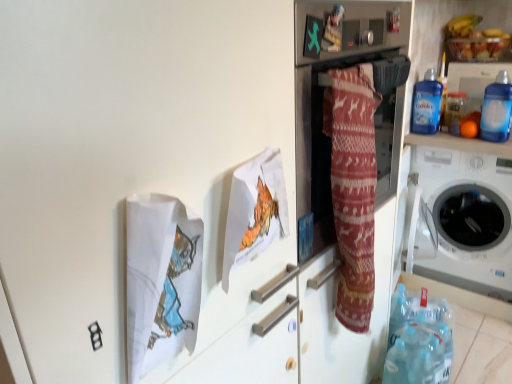
Question: From a real-world perspective, relative to blue plastic bottle at upper right, marked as the third bottle in a back-to-front arrangement, is orange matte at upper right vertically above or below?

Choices:
 (A) below
 (B) above

Answer: (A)

Question: Is point (459, 130) closer or farther from the camera than point (433, 82)?

Choices:
 (A) closer
 (B) farther

Answer: (B)

Question: Which object is positioned farthest from the patterned fabric at center?

Choices:
 (A) transparent plastic bottle at upper right, the third bottle from the front
 (B) blue plastic bottle at upper right, which appears as the 2th bottle when viewed from the front
 (C) blue plastic bottle at upper right, the 1th bottle viewed from the front
 (D) orange matte at upper right
 (E) translucent plastic bowl at upper right

Answer: (E)

Question: Which object is the farthest from the blue plastic bottle at upper right, the 4th bottle from the front?

Choices:
 (A) translucent plastic bowl at upper right
 (B) orange matte at upper right
 (C) blue plastic bottles at upper right
 (D) blue plastic bottle at upper right, the 1th bottle viewed from the front
 (E) white plastic washing machine at right

Answer: (E)